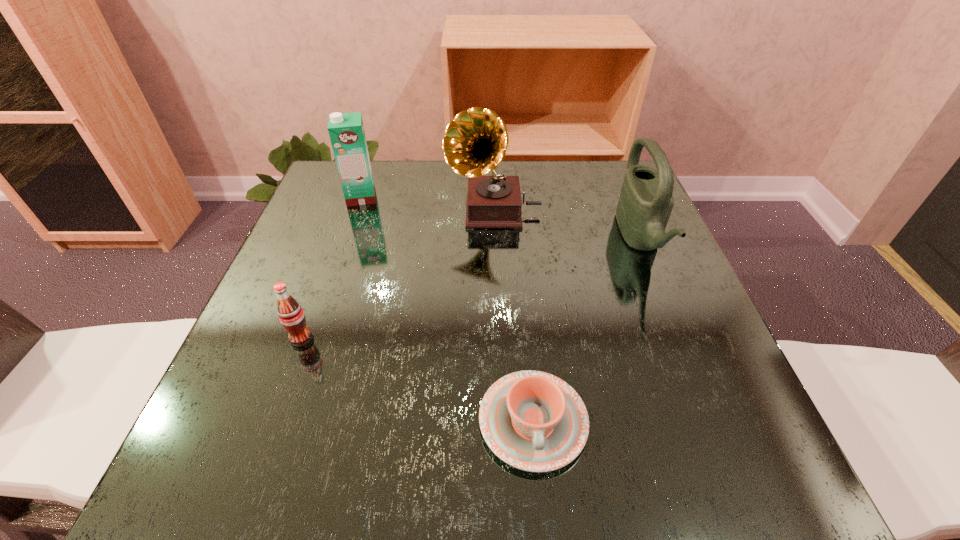
Where is `object that is the third closest to the shortest object`? Image resolution: width=960 pixels, height=540 pixels. object that is the third closest to the shortest object is located at coordinates (475, 142).